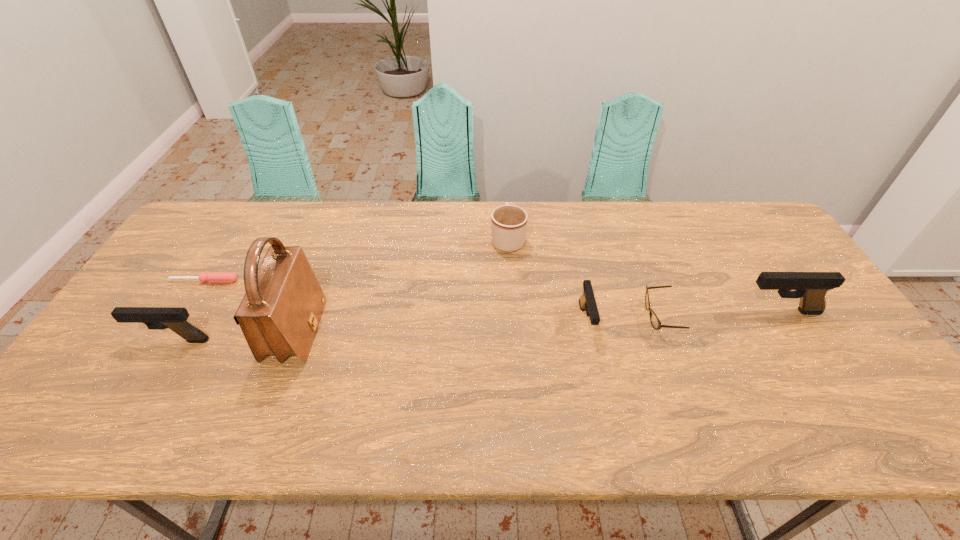
The image size is (960, 540). I want to click on the second shortest pistol, so click(x=157, y=318).

Find the location of `the second pistol from right to left`. the second pistol from right to left is located at coordinates (587, 302).

Locate an element on the screen. This screenshot has height=540, width=960. the fifth tallest object is located at coordinates (587, 302).

In order to click on the tallest pistol in this screenshot , I will do `click(811, 287)`.

At what (x,y) coordinates should I click in order to perform the action: click on the rightmost object. Please return your answer as a coordinate pair (x, y). Looking at the image, I should click on (811, 287).

The width and height of the screenshot is (960, 540). I want to click on screwdriver, so click(213, 277).

Where is `the sixth nearest object`? The width and height of the screenshot is (960, 540). the sixth nearest object is located at coordinates (213, 277).

The image size is (960, 540). I want to click on the fourth object from right to left, so click(x=508, y=222).

Locate an element on the screen. The width and height of the screenshot is (960, 540). mug is located at coordinates (508, 222).

This screenshot has height=540, width=960. In order to click on shoulder bag in this screenshot , I will do `click(279, 314)`.